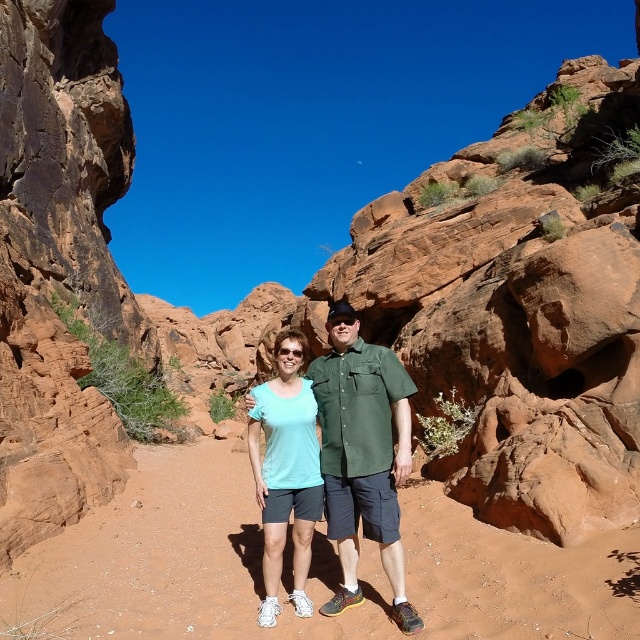
You are planning to take a photo of the sandy soil at center and the matte green shirt at center in the scene. The camera you are using has a maximum focus range of 10 meters. Will both subjects be in focus at the same time?

The sandy soil at center and matte green shirt at center are 10.05 meters apart from each other. Since the camera has a maximum focus range of 10 meters, the distance between them slightly exceeds this limit. Therefore, both subjects cannot be in focus simultaneously.

You are a photographer positioned on the sandy path trying to capture both the matte green shirt at center and the matte teal shirt at center in a single frame. Which person should you move closer to in order to ensure both are fully visible?

You should move closer to the matte teal shirt at center because the matte green shirt at center is in front of it, so moving towards the teal shirt will allow both to be in the frame without obstruction.

In the scene shown: You are a photographer positioned on the sandy path between the two people wearing the matte green shirt at center and the matte teal shirt at center. You want to capture a photo that includes both of them in the frame. Given that your camera has a maximum focus range of 5 meters, will you be able to include both in the photo without moving closer?

The matte green shirt at center and matte teal shirt at center are 5.14 meters apart from each other. Since the distance between them exceeds the camera maximum focus range of 5 meters, you will not be able to include both in the photo without moving closer.